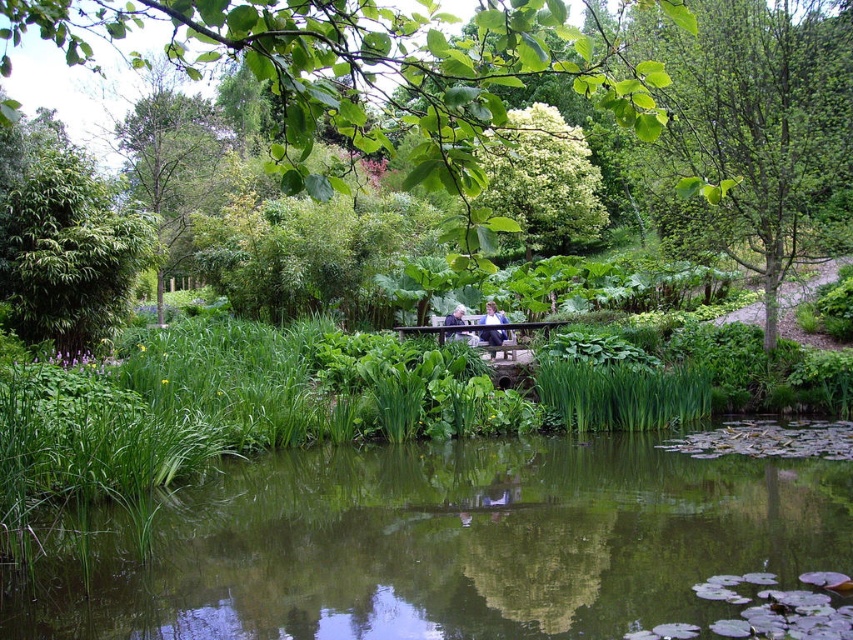
You are standing at the edge of the pond in the garden scene. You notice two points marked in the image. Which point, point (262, 0) or point (456, 321), is closer to you?

Point (262, 0) is closer to the viewer than point (456, 321).

You are standing in the garden and want to take a photo of the light blue fabric at center without the green leafy tree at upper center blocking it. How should you position yourself?

Move to a position where the light blue fabric at center is not behind the green leafy tree at upper center. Since the green leafy tree at upper center is in front of the light blue fabric at center, you need to move to a side angle where the tree is no longer blocking the fabric.